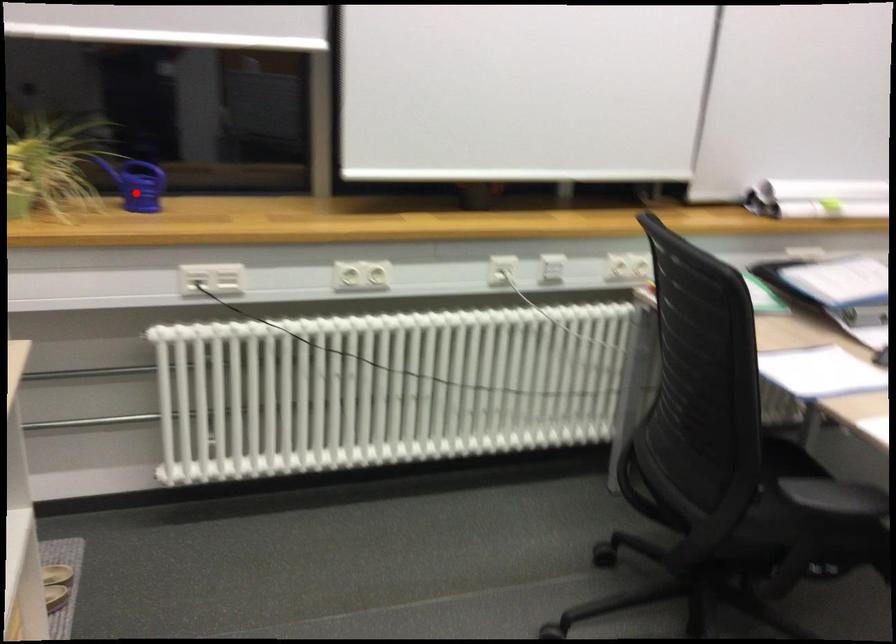
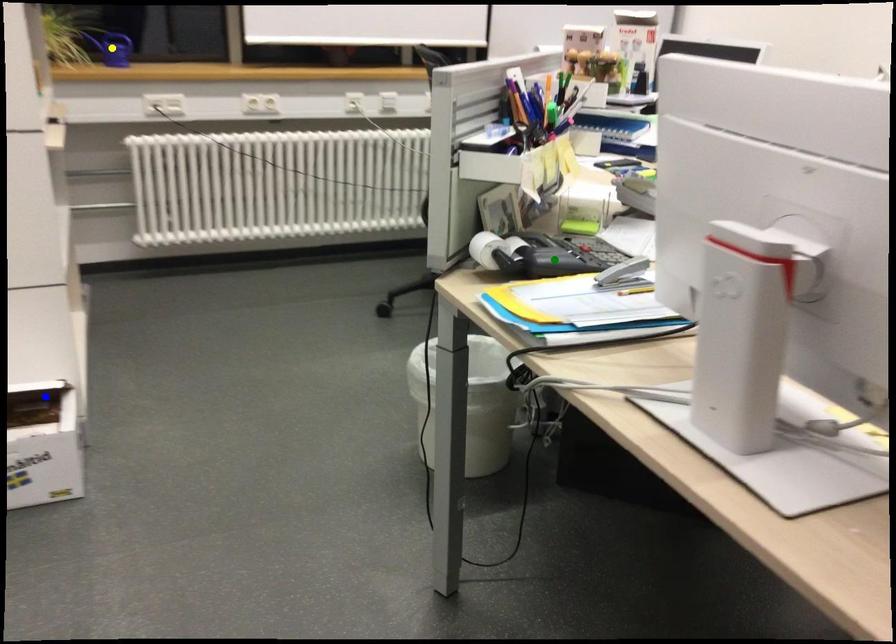
Question: I am providing you with two images of the same scene from different viewpoints. A red point is marked on the first image. You are given multiple points on the second image. Which point in image 2 is actually the same real-world point as the red point in image 1?

Choices:
 (A) yellow point
 (B) blue point
 (C) green point

Answer: (A)